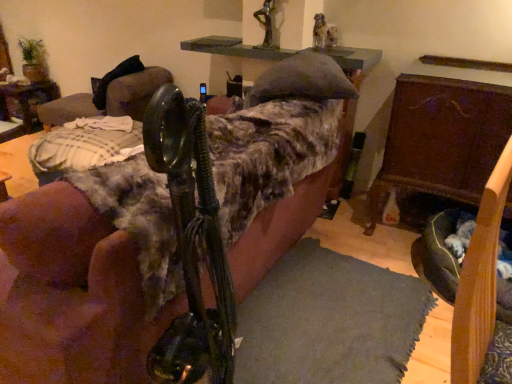
Looking at this image, measure the distance between point (66, 98) and camera.

The distance of point (66, 98) from camera is 11.67 feet.

The height and width of the screenshot is (384, 512). I want to click on wooden chest at right, placed as the first furniture when sorted from right to left, so pos(445,129).

The width and height of the screenshot is (512, 384). What do you see at coordinates (30, 100) in the screenshot?
I see `wooden table at left` at bounding box center [30, 100].

At what (x,y) coordinates should I click in order to perform the action: click on metallic statue at upper center. Please return your answer as a coordinate pair (x, y). This screenshot has width=512, height=384. Looking at the image, I should click on (266, 22).

Identify the location of velvet couch at center, placed as the second furniture when sorted from right to left. (88, 276).

The image size is (512, 384). In order to click on dark gray fabric dog bed at lower right in this screenshot , I will do `click(439, 254)`.

What are the coordinates of `black leather swivel chair at upper left` in the screenshot? It's located at (108, 98).

Consider the image. Looking at their sizes, would you say wooden chest at right, placed as the first furniture when sorted from right to left, is wider or thinner than wooden table at left?

In the image, wooden chest at right, placed as the first furniture when sorted from right to left, appears to be wider than wooden table at left.

Considering the relative sizes of wooden chest at right, placed as the first furniture when sorted from right to left, and wooden table at left in the image provided, is wooden chest at right, placed as the first furniture when sorted from right to left, taller than wooden table at left?

Yes, wooden chest at right, placed as the first furniture when sorted from right to left, is taller than wooden table at left.

Does wooden chest at right, placed as the first furniture when sorted from right to left, appear on the right side of wooden table at left?

Correct, you'll find wooden chest at right, placed as the first furniture when sorted from right to left, to the right of wooden table at left.

There is a dark gray fabric dog bed at lower right. Find the location of `the 1st furniture above it (from the image's perspective)`. the 1st furniture above it (from the image's perspective) is located at coordinates (88, 276).

Is velvet couch at center, the first furniture viewed from the left, inside dark gray fabric dog bed at lower right?

No, dark gray fabric dog bed at lower right does not contain velvet couch at center, the first furniture viewed from the left.

What's the angular difference between dark gray fabric dog bed at lower right and velvet couch at center, placed as the second furniture when sorted from right to left,'s facing directions?

85.1 degrees.

Looking at this image, is dark gray fabric dog bed at lower right oriented away from velvet couch at center, placed as the second furniture when sorted from right to left?

No.

Based on the photo, is velvet couch at center, placed as the second furniture when sorted from right to left, beside dark gray fabric dog bed at lower right?

No, velvet couch at center, placed as the second furniture when sorted from right to left, is not touching dark gray fabric dog bed at lower right.

Considering the relative sizes of velvet couch at center, the first furniture viewed from the left, and dark gray fabric dog bed at lower right in the image provided, is velvet couch at center, the first furniture viewed from the left, smaller than dark gray fabric dog bed at lower right?

Incorrect, velvet couch at center, the first furniture viewed from the left, is not smaller in size than dark gray fabric dog bed at lower right.

From the picture: Considering the relative positions of velvet couch at center, placed as the second furniture when sorted from right to left, and dark gray fabric dog bed at lower right in the image provided, is velvet couch at center, placed as the second furniture when sorted from right to left, to the right of dark gray fabric dog bed at lower right from the viewer's perspective?

In fact, velvet couch at center, placed as the second furniture when sorted from right to left, is to the left of dark gray fabric dog bed at lower right.

Can you confirm if velvet couch at center, the first furniture viewed from the left, is shorter than dark gray fabric dog bed at lower right?

No.

From the image's perspective, is wooden chest at right, placed as the first furniture when sorted from right to left, located above or below velvet couch at center, the first furniture viewed from the left?

From the image's perspective, wooden chest at right, placed as the first furniture when sorted from right to left, appears above velvet couch at center, the first furniture viewed from the left.

Would you consider wooden chest at right, which is the second furniture in left-to-right order, to be distant from velvet couch at center, placed as the second furniture when sorted from right to left?

No, wooden chest at right, which is the second furniture in left-to-right order, is in close proximity to velvet couch at center, placed as the second furniture when sorted from right to left.

Who is taller, wooden chest at right, placed as the first furniture when sorted from right to left, or velvet couch at center, placed as the second furniture when sorted from right to left?

wooden chest at right, placed as the first furniture when sorted from right to left.

Is wooden chest at right, placed as the first furniture when sorted from right to left, facing away from velvet couch at center, placed as the second furniture when sorted from right to left?

No, wooden chest at right, placed as the first furniture when sorted from right to left, is not facing the opposite direction of velvet couch at center, placed as the second furniture when sorted from right to left.

Can you confirm if dark gray fabric dog bed at lower right is taller than wooden table at left?

No.

Between point (423, 245) and point (5, 93), which one is positioned behind?

Positioned behind is point (5, 93).

Is dark gray fabric dog bed at lower right inside or outside of wooden table at left?

dark gray fabric dog bed at lower right is outside wooden table at left.

Between dark gray fabric dog bed at lower right and wooden table at left, which one appears on the right side from the viewer's perspective?

dark gray fabric dog bed at lower right is more to the right.

From a real-world perspective, is velvet couch at center, placed as the second furniture when sorted from right to left, positioned under wooden table at left based on gravity?

No, from a real-world perspective, velvet couch at center, placed as the second furniture when sorted from right to left, is not beneath wooden table at left.

Does point (145, 293) come closer to viewer compared to point (52, 98)?

Yes, point (145, 293) is closer to viewer.

Which of these two, velvet couch at center, the first furniture viewed from the left, or wooden table at left, is thinner?

wooden table at left.

Would you say metallic statue at upper center is inside or outside velvet couch at center, placed as the second furniture when sorted from right to left?

metallic statue at upper center is located beyond the bounds of velvet couch at center, placed as the second furniture when sorted from right to left.

Is metallic statue at upper center to the right of velvet couch at center, placed as the second furniture when sorted from right to left, from the viewer's perspective?

Indeed, metallic statue at upper center is positioned on the right side of velvet couch at center, placed as the second furniture when sorted from right to left.

Is metallic statue at upper center not close to velvet couch at center, placed as the second furniture when sorted from right to left?

That's right, there is a large distance between metallic statue at upper center and velvet couch at center, placed as the second furniture when sorted from right to left.

From the wooden table at left, count 2nd furniture to the right and point to it. Please provide its 2D coordinates.

[(445, 129)]

I want to click on furniture on the left side of dark gray fabric dog bed at lower right, so click(88, 276).

When comparing their distances from dark gray fabric dog bed at lower right, does wooden table at left or wooden chest at right, which is the second furniture in left-to-right order, seem closer?

wooden chest at right, which is the second furniture in left-to-right order, lies closer to dark gray fabric dog bed at lower right than the other object.

When comparing their distances from wooden chest at right, placed as the first furniture when sorted from right to left, does wooden table at left or dark gray fabric dog bed at lower right seem closer?

dark gray fabric dog bed at lower right.

Considering their positions, is black leather swivel chair at upper left positioned closer to velvet couch at center, placed as the second furniture when sorted from right to left, than dark gray fabric dog bed at lower right?

dark gray fabric dog bed at lower right is positioned closer to the anchor velvet couch at center, placed as the second furniture when sorted from right to left.

Estimate the real-world distances between objects in this image. Which object is further from wooden table at left, black leather swivel chair at upper left or metallic statue at upper center?

metallic statue at upper center is positioned further to the anchor wooden table at left.

Which object lies further to the anchor point wooden table at left, wooden chest at right, which is the second furniture in left-to-right order, or metallic statue at upper center?

Answer: wooden chest at right, which is the second furniture in left-to-right order.

Considering their positions, is velvet couch at center, the first furniture viewed from the left, positioned closer to wooden chest at right, placed as the first furniture when sorted from right to left, than black leather swivel chair at upper left?

Based on the image, velvet couch at center, the first furniture viewed from the left, appears to be nearer to wooden chest at right, placed as the first furniture when sorted from right to left.

Considering their positions, is dark gray fabric dog bed at lower right positioned closer to black leather swivel chair at upper left than wooden chest at right, which is the second furniture in left-to-right order?

wooden chest at right, which is the second furniture in left-to-right order.

Based on their spatial positions, is dark gray fabric dog bed at lower right or metallic statue at upper center further from black leather swivel chair at upper left?

Based on the image, dark gray fabric dog bed at lower right appears to be further to black leather swivel chair at upper left.

Image resolution: width=512 pixels, height=384 pixels. Find the location of `furniture between black leather swivel chair at upper left and wooden chest at right, which is the second furniture in left-to-right order, in the horizontal direction`. furniture between black leather swivel chair at upper left and wooden chest at right, which is the second furniture in left-to-right order, in the horizontal direction is located at coordinates (88, 276).

At what (x,y) coordinates should I click in order to perform the action: click on swivel chair between wooden table at left and dark gray fabric dog bed at lower right. Please return your answer as a coordinate pair (x, y). The image size is (512, 384). Looking at the image, I should click on (108, 98).

Where is `dog bed situated between velvet couch at center, placed as the second furniture when sorted from right to left, and wooden chest at right, which is the second furniture in left-to-right order, from left to right`? This screenshot has height=384, width=512. dog bed situated between velvet couch at center, placed as the second furniture when sorted from right to left, and wooden chest at right, which is the second furniture in left-to-right order, from left to right is located at coordinates (439, 254).

Locate an element on the screen. person situated between black leather swivel chair at upper left and dark gray fabric dog bed at lower right from left to right is located at coordinates (266, 22).